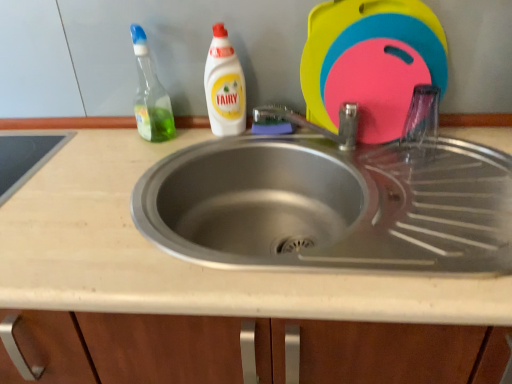
Image resolution: width=512 pixels, height=384 pixels. In order to click on free space on the front side of white plastic bottle at upper center, positioned as the 1th cleaning product in right-to-left order in this screenshot , I will do `click(203, 154)`.